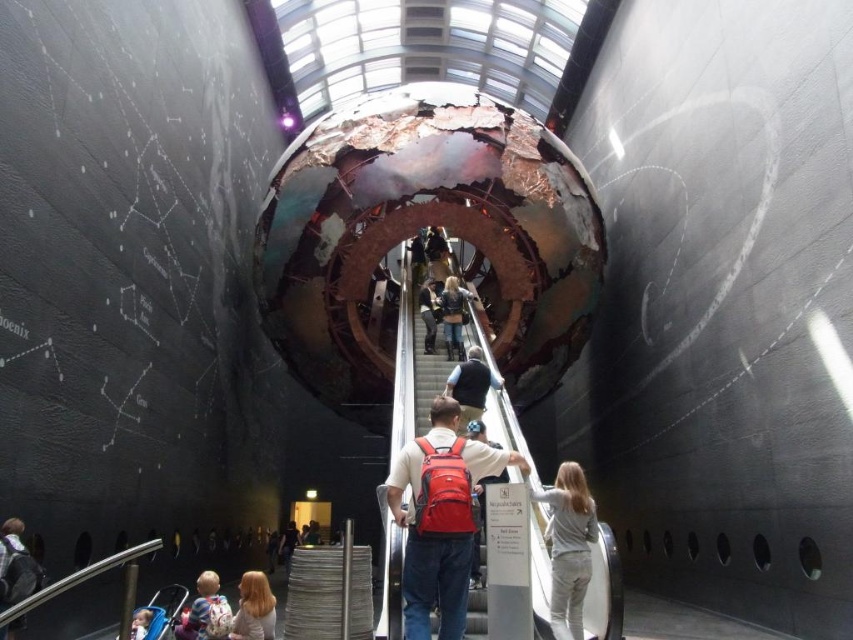
Between point (213, 592) and point (431, 349), which one is positioned in front?

Positioned in front is point (213, 592).

Does light brown fabric baby at lower left appear under matte black jacket at center?

Indeed, light brown fabric baby at lower left is positioned under matte black jacket at center.

Who is more distant from viewer, (x=196, y=616) or (x=421, y=316)?

The point (x=421, y=316) is more distant.

Find the location of a particular element. This screenshot has height=640, width=853. light brown fabric baby at lower left is located at coordinates [201, 602].

Is light gray fabric jacket at center to the right of metallic vest at center from the viewer's perspective?

Yes, light gray fabric jacket at center is to the right of metallic vest at center.

Does light gray fabric jacket at center lie in front of metallic vest at center?

Yes, light gray fabric jacket at center is closer to the viewer.

Does point (572, 618) come in front of point (461, 380)?

Yes.

This screenshot has height=640, width=853. What are the coordinates of `light gray fabric jacket at center` in the screenshot? It's located at (567, 547).

Which is in front, point (469, 346) or point (264, 604)?

Point (264, 604) is more forward.

Is point (462, 403) closer to camera compared to point (254, 608)?

No, it is not.

At what (x,y) coordinates should I click in order to perform the action: click on metallic vest at center. Please return your answer as a coordinate pair (x, y). Image resolution: width=853 pixels, height=640 pixels. Looking at the image, I should click on (469, 387).